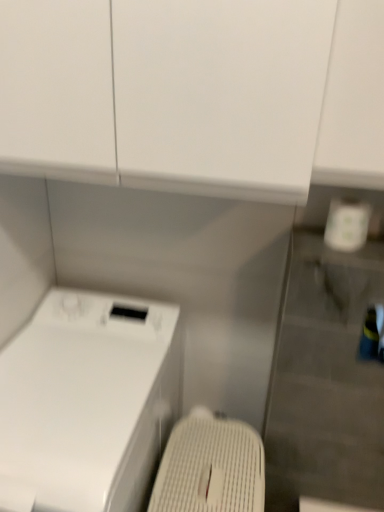
Question: Is white glossy washing machine at lower left wider or thinner than white textured washing machine at lower center?

Choices:
 (A) thin
 (B) wide

Answer: (B)

Question: From the image's perspective, is white glossy washing machine at lower left located above or below white textured washing machine at lower center?

Choices:
 (A) above
 (B) below

Answer: (A)

Question: From a real-world perspective, is white glossy washing machine at lower left positioned above or below white textured washing machine at lower center?

Choices:
 (A) above
 (B) below

Answer: (A)

Question: In terms of height, does white textured washing machine at lower center look taller or shorter compared to white glossy washing machine at lower left?

Choices:
 (A) tall
 (B) short

Answer: (B)

Question: From the image's perspective, relative to white glossy washing machine at lower left, is white textured washing machine at lower center above or below?

Choices:
 (A) above
 (B) below

Answer: (B)

Question: Considering their positions, is white textured washing machine at lower center located in front of or behind white glossy washing machine at lower left?

Choices:
 (A) behind
 (B) front

Answer: (A)

Question: Is point (221, 461) closer or farther from the camera than point (144, 320)?

Choices:
 (A) farther
 (B) closer

Answer: (B)